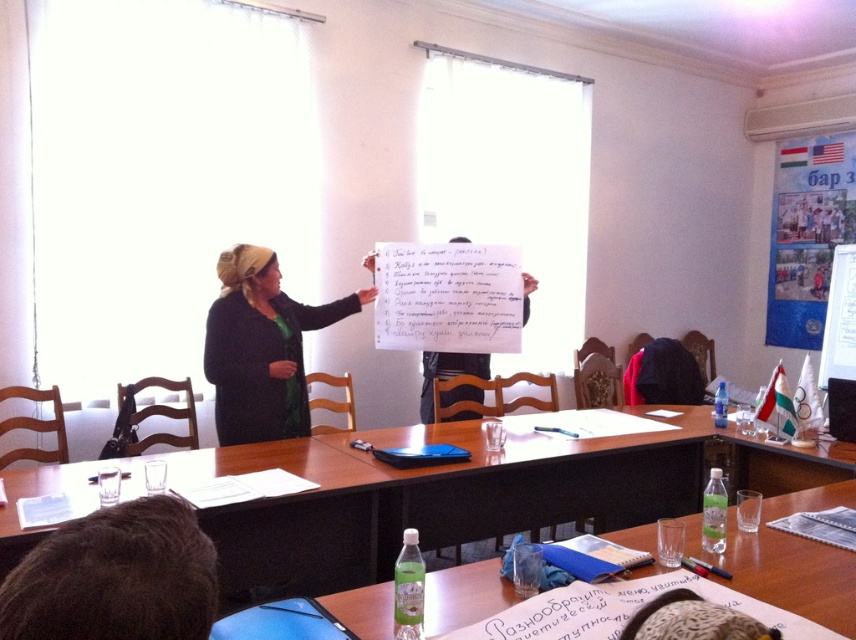
Is point (373, 596) farther from viewer compared to point (459, 362)?

No.

Where is `wooden table at center`? This screenshot has height=640, width=856. wooden table at center is located at coordinates pos(785,572).

Is the position of dark green fabric headscarf at center less distant than that of white paper at center?

Yes, it is in front of white paper at center.

What do you see at coordinates (260, 348) in the screenshot?
I see `dark green fabric headscarf at center` at bounding box center [260, 348].

Measure the distance between dark green fabric headscarf at center and camera.

dark green fabric headscarf at center and camera are 9.59 feet apart from each other.

At what (x,y) coordinates should I click in order to perform the action: click on dark green fabric headscarf at center. Please return your answer as a coordinate pair (x, y). Image resolution: width=856 pixels, height=640 pixels. Looking at the image, I should click on (260, 348).

Consider the image. Can you confirm if brown wooden table at center is wider than white paper at center?

Correct, the width of brown wooden table at center exceeds that of white paper at center.

The height and width of the screenshot is (640, 856). Describe the element at coordinates (300, 518) in the screenshot. I see `brown wooden table at center` at that location.

Is point (254, 548) positioned behind point (455, 388)?

No, (254, 548) is closer to viewer.

At what (x,y) coordinates should I click in order to perform the action: click on brown wooden table at center. Please return your answer as a coordinate pair (x, y). This screenshot has height=640, width=856. Looking at the image, I should click on (300, 518).